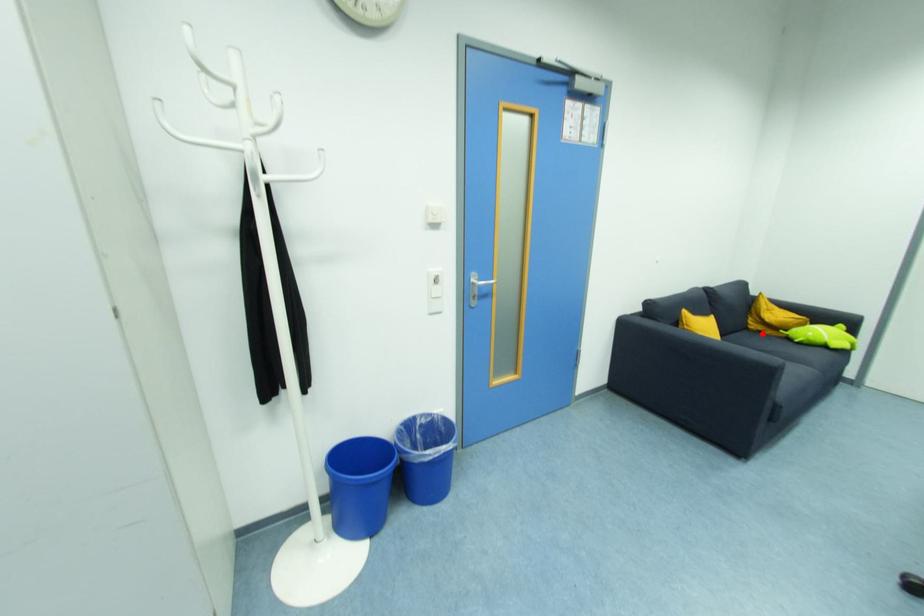
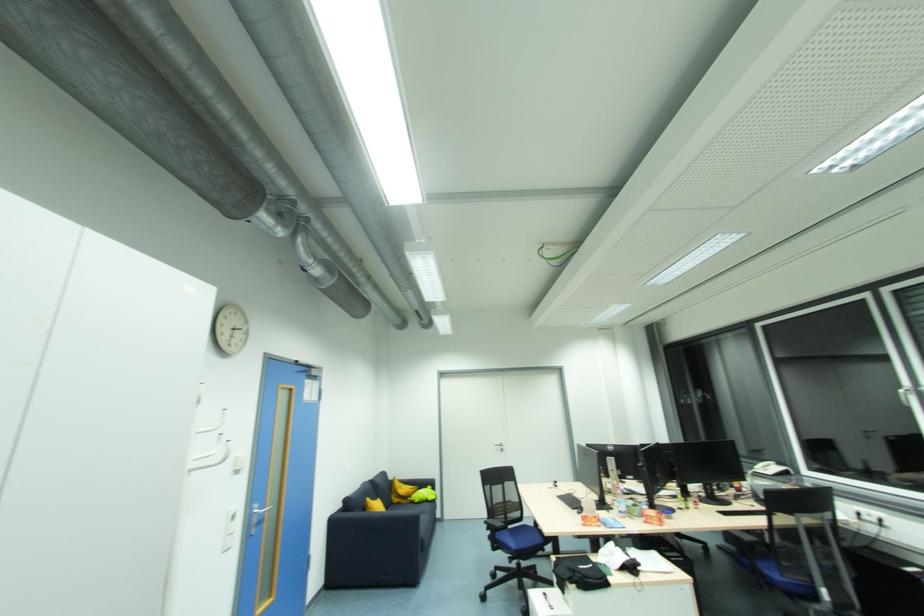
Find the pixel in the second image that matches the highlighted location in the first image.

(400, 505)